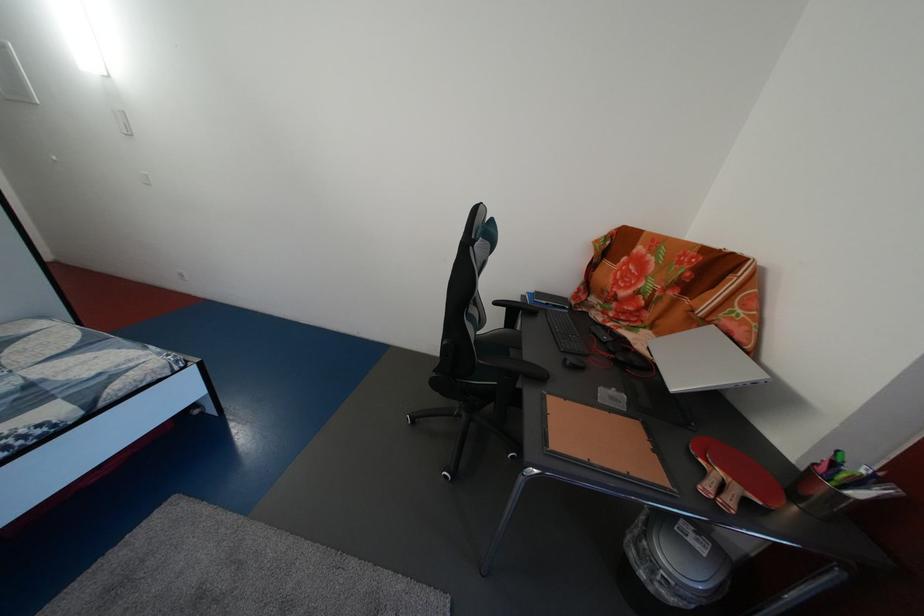
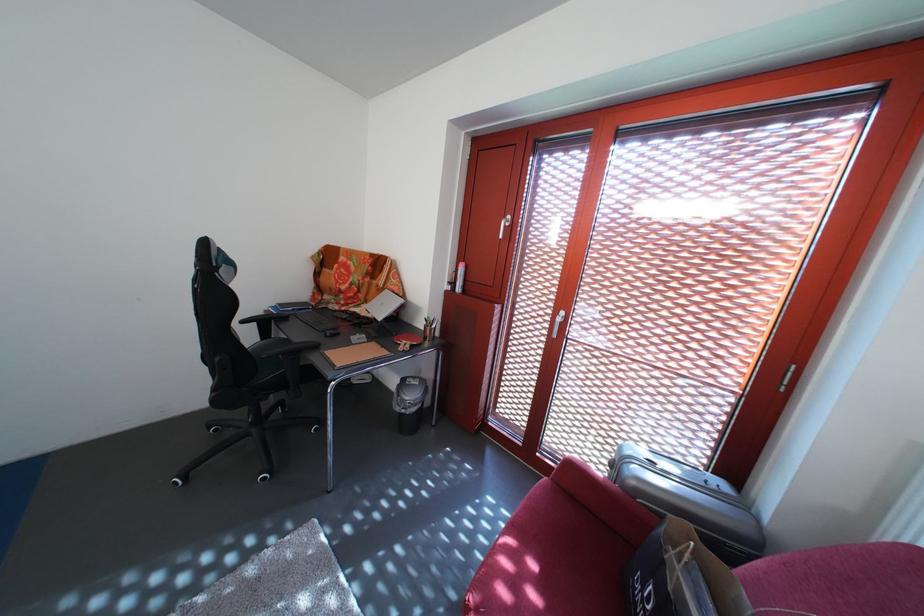
The point at (642, 560) is marked in the first image. Where is the corresponding point in the second image?

(408, 416)